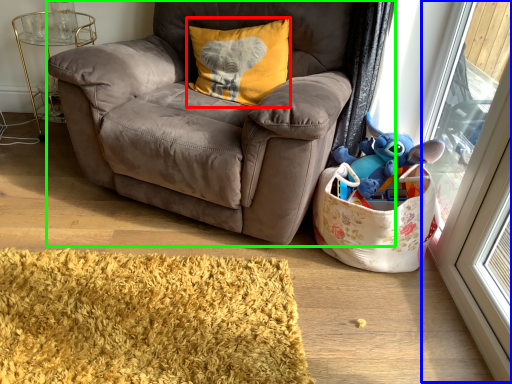
Question: Which object is the closest to the pillow (highlighted by a red box)? Choose among these: screen door (highlighted by a blue box) or chair (highlighted by a green box).

Choices:
 (A) screen door
 (B) chair

Answer: (B)